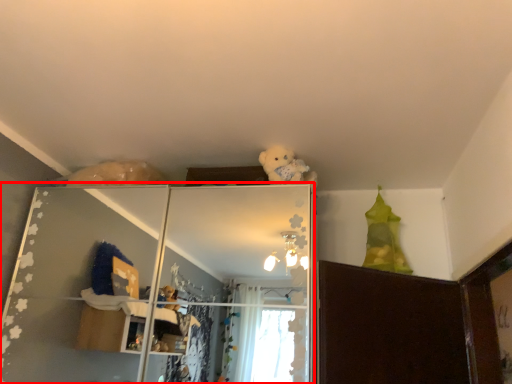
Question: From the image's perspective, where is shelf (annotated by the red box) located relative to teddy?

Choices:
 (A) above
 (B) below

Answer: (B)